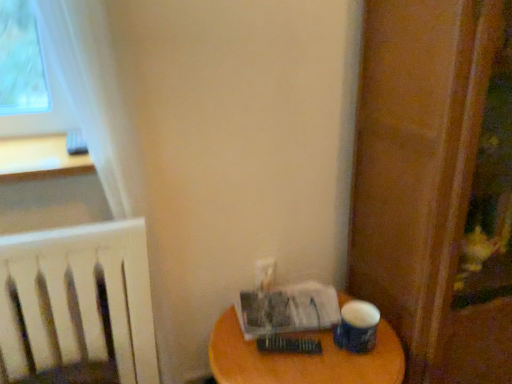
Locate an element on the screen. Image resolution: width=512 pixels, height=384 pixels. free location in front of hardcover book at center, the 2th paperback book in the back-to-front sequence is located at coordinates (294, 372).